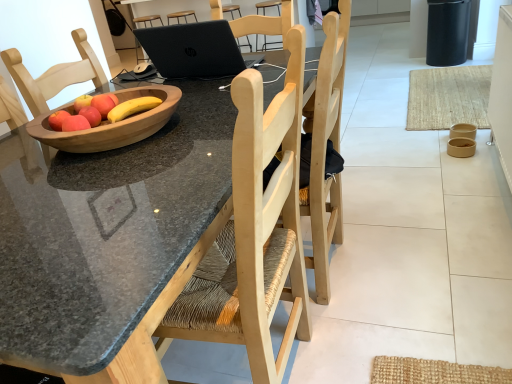
I want to click on blank space to the left of brown paper bowl at lower right, which is the second bowl from front to back, so click(x=431, y=158).